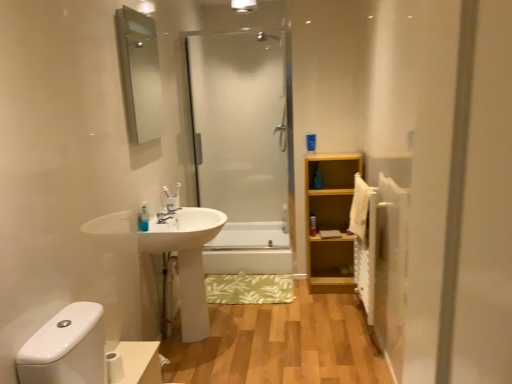
The height and width of the screenshot is (384, 512). I want to click on blank space situated above white glossy toilet paper at lower left (from a real-world perspective), so click(131, 352).